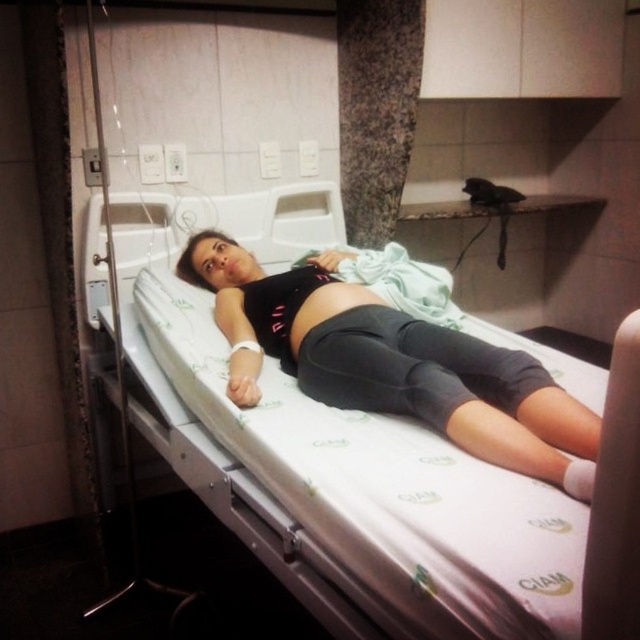
Which is below, white fabric hospital bed at center or black matte leggings at center?

white fabric hospital bed at center is below.

Between point (218, 416) and point (529, 456), which one is positioned in front?

Point (529, 456) is more forward.

Measure the distance between point (368, 592) and camera.

The distance of point (368, 592) from camera is 1.03 meters.

Identify the location of white fabric hospital bed at center. The image size is (640, 640). coord(346,465).